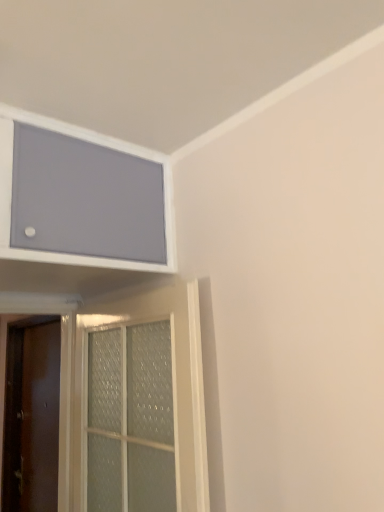
Question: Is clear glass door at lower left, acting as the 2th door starting from the back, inside or outside of matte gray screen at upper left?

Choices:
 (A) outside
 (B) inside

Answer: (A)

Question: From the image's perspective, relative to matte gray screen at upper left, is clear glass door at lower left, positioned as the 2th door in left-to-right order, above or below?

Choices:
 (A) above
 (B) below

Answer: (B)

Question: Estimate the real-world distances between objects in this image. Which object is closer to the clear glass door at lower left, acting as the 2th door starting from the back?

Choices:
 (A) matte gray screen at upper left
 (B) brown matte door at left, positioned as the 1th door in left-to-right order

Answer: (A)

Question: Estimate the real-world distances between objects in this image. Which object is farther from the clear glass door at lower left, positioned as the 2th door in left-to-right order?

Choices:
 (A) brown matte door at left, the second door from the front
 (B) matte gray screen at upper left

Answer: (A)